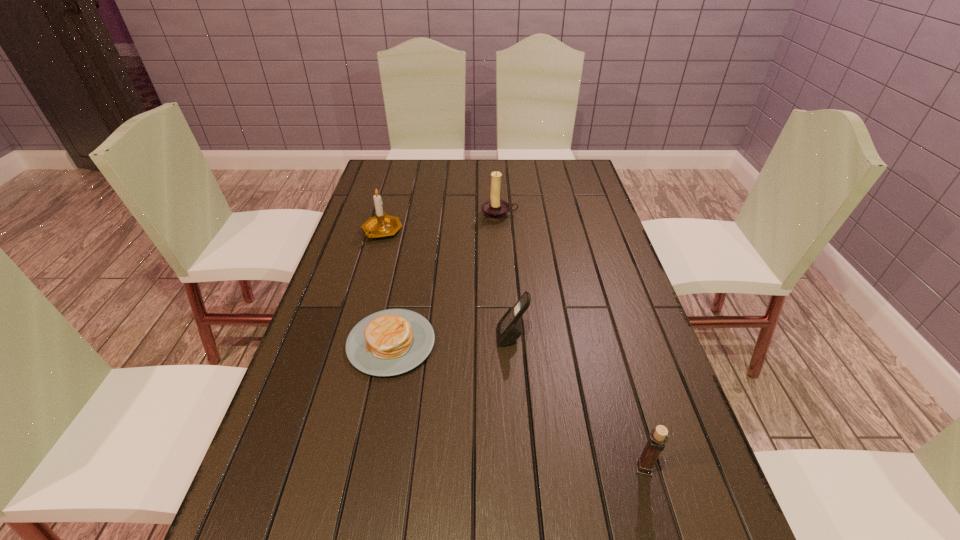
The width and height of the screenshot is (960, 540). I want to click on the second candle holder from left to right, so click(494, 209).

You are a GUI agent. You are given a task and a screenshot of the screen. Output one action in this format:
    pyautogui.click(x=<x>, y=<y>)
    Task: Click on the leftmost candle holder
    Image resolution: width=960 pixels, height=540 pixels.
    Given the screenshot: What is the action you would take?
    pyautogui.click(x=381, y=225)

Image resolution: width=960 pixels, height=540 pixels. I want to click on cellular telephone, so click(509, 328).

The width and height of the screenshot is (960, 540). Identify the location of the nearest object. (658, 437).

At what (x,y) coordinates should I click in order to perform the action: click on the rightmost object. Please return your answer as a coordinate pair (x, y). The height and width of the screenshot is (540, 960). Looking at the image, I should click on (658, 437).

You are a GUI agent. You are given a task and a screenshot of the screen. Output one action in this format:
    pyautogui.click(x=<x>, y=<y>)
    Task: Click on the shortest object
    Image resolution: width=960 pixels, height=540 pixels.
    Given the screenshot: What is the action you would take?
    pyautogui.click(x=390, y=342)

The width and height of the screenshot is (960, 540). Identify the location of vacant space located 0.110m on the wick of the second candle holder from right to left. (501, 241).

Identify the location of blank space located 0.310m on the front of the leftmost candle holder. The height and width of the screenshot is (540, 960). (358, 316).

At what (x,y) coordinates should I click in order to perform the action: click on vacant space located 0.190m on the front-facing side of the cellular telephone. Please return your answer as a coordinate pair (x, y). Looking at the image, I should click on (421, 337).

This screenshot has width=960, height=540. I want to click on vacant space located on the front-facing side of the cellular telephone, so click(472, 337).